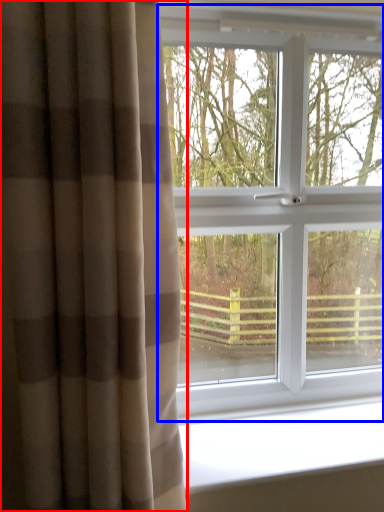
Question: Which of the following is the farthest to the observer, curtain (highlighted by a red box) or window (highlighted by a blue box)?

Choices:
 (A) curtain
 (B) window

Answer: (B)